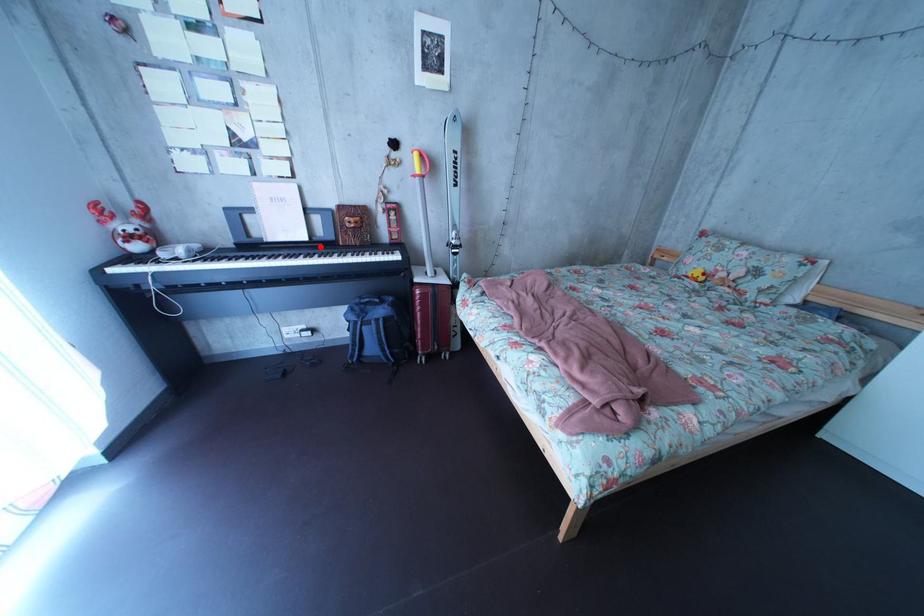
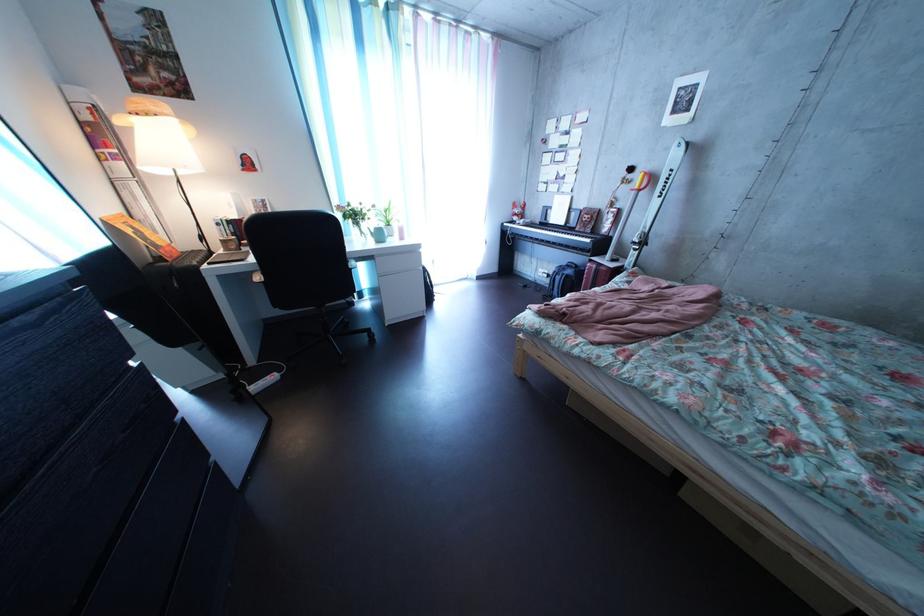
Question: I am providing you with two images of the same scene from different viewpoints. A red point is marked on the first image. Can you still see the location of the red point in image 2?

Choices:
 (A) Yes
 (B) No

Answer: (A)